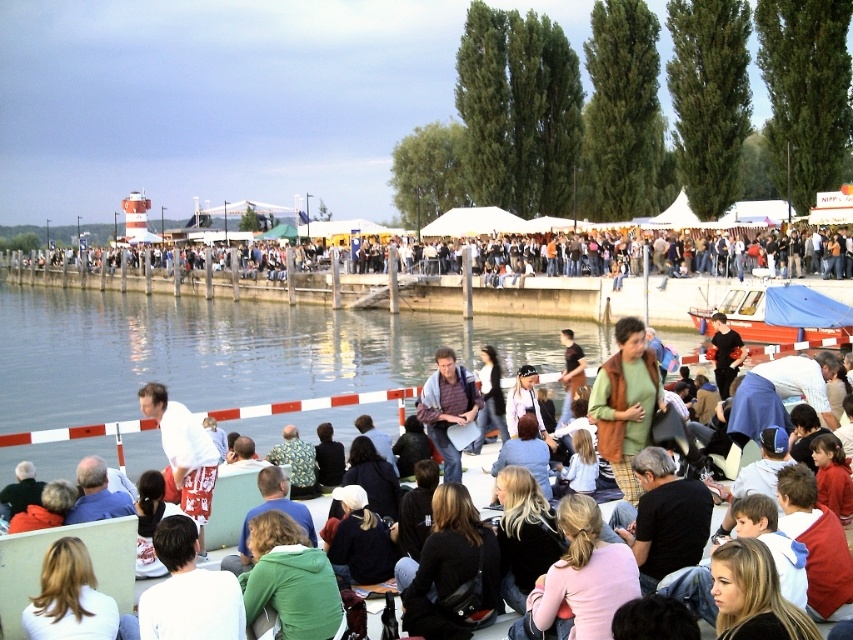
You are a photographer trying to capture a photo of the waterfront scene. You notice the green fabric jacket at center and the pink fabric shirt at lower center in your frame. Which clothing item will appear larger in your photo?

The green fabric jacket at center will appear larger in the photo because it is taller than the pink fabric shirt at lower center.

You are standing at the point labeled as point (x=186, y=358). What is the surface condition of the water at that location?

Result: The surface condition of the water at point (x=186, y=358) is smooth.

You are a photographer trying to capture the smooth water at lower center and the pink fabric shirt at lower center in a single shot. Given that your camera can only focus on one subject at a time, which object should you prioritize focusing on to ensure it appears sharp and clear in the photo?

The smooth water at lower center has a larger size compared to the pink fabric shirt at lower center, so focusing on the smooth water at lower center would ensure it appears sharp and clear in the photo.